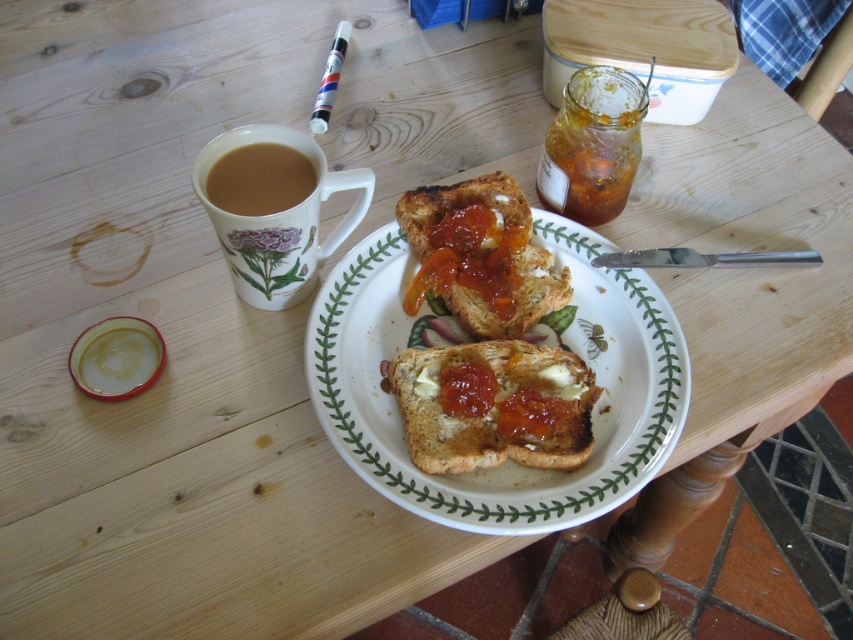
Question: Does white ceramic plate at center have a larger size compared to brown matte mug at upper left?

Choices:
 (A) yes
 (B) no

Answer: (A)

Question: Which point is farther to the camera?

Choices:
 (A) (248, 248)
 (B) (646, 468)
 (C) (544, 378)
 (D) (601, 72)

Answer: (D)

Question: Which object is closer to the camera taking this photo?

Choices:
 (A) porcelain mug at upper left
 (B) brown matte mug at upper left
 (C) translucent amber jam at upper right

Answer: (A)

Question: Where is golden brown toast at center located in relation to brown matte mug at upper left in the image?

Choices:
 (A) below
 (B) above

Answer: (A)

Question: Does porcelain mug at upper left appear on the right side of brown matte mug at upper left?

Choices:
 (A) yes
 (B) no

Answer: (A)

Question: Which object appears closest to the camera in this image?

Choices:
 (A) translucent amber jam at upper right
 (B) brown matte mug at upper left
 (C) white ceramic plate at center
 (D) golden brown toast at center

Answer: (C)